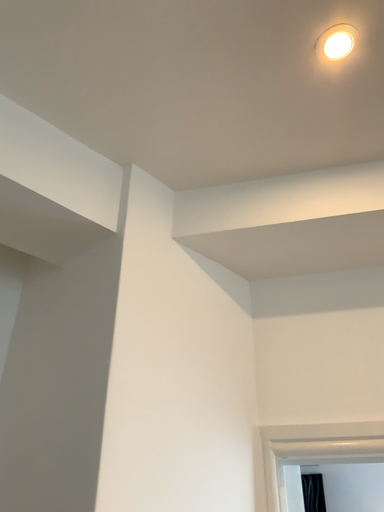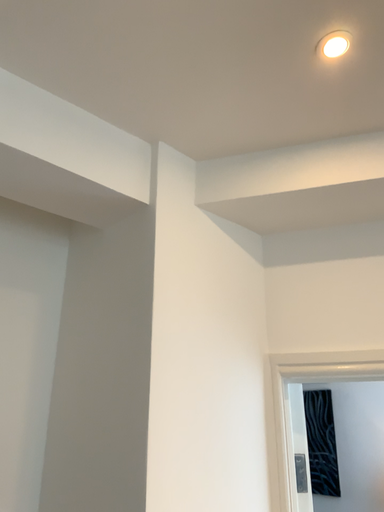
Question: How did the camera likely rotate when shooting the video?

Choices:
 (A) rotated downward
 (B) rotated upward

Answer: (A)